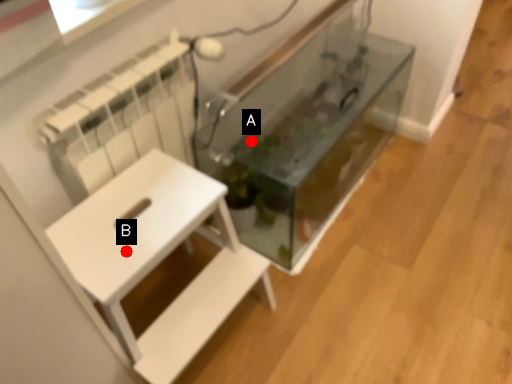
Question: Two points are circled on the image, labeled by A and B beside each circle. Among these points, which one is farthest from the camera?

Choices:
 (A) A is further
 (B) B is further

Answer: (A)